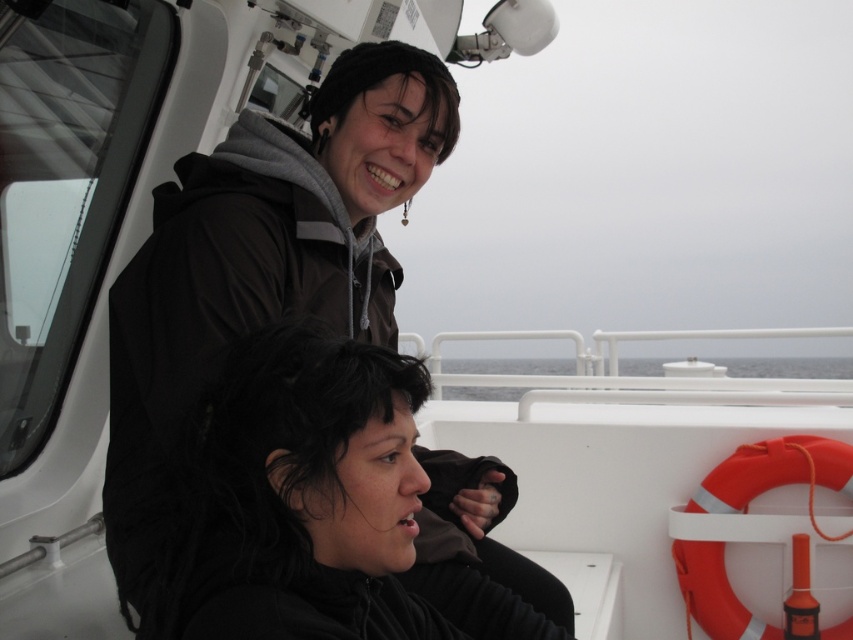
Question: Which of the following is the farthest from the observer?

Choices:
 (A) (386, 634)
 (B) (848, 390)
 (C) (677, 570)

Answer: (B)

Question: In this image, where is orange rubber life jacket at right located relative to gray water at center?

Choices:
 (A) right
 (B) left

Answer: (A)

Question: Estimate the real-world distances between objects in this image. Which object is farther from the orange rubber life jacket at right?

Choices:
 (A) gray water at center
 (B) black matte hair at center

Answer: (B)

Question: Is orange rubber life jacket at right to the left of gray water at center from the viewer's perspective?

Choices:
 (A) yes
 (B) no

Answer: (B)

Question: Which object is farther from the camera taking this photo?

Choices:
 (A) orange rubber life jacket at right
 (B) gray water at center
 (C) black matte hair at center

Answer: (B)

Question: Does black matte hair at center appear over orange rubber life jacket at right?

Choices:
 (A) yes
 (B) no

Answer: (A)